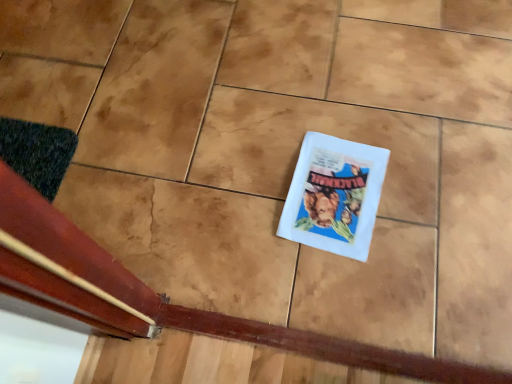
Identify the location of blank space situated above white paper at center (from a real-world perspective). Image resolution: width=512 pixels, height=384 pixels. (338, 185).